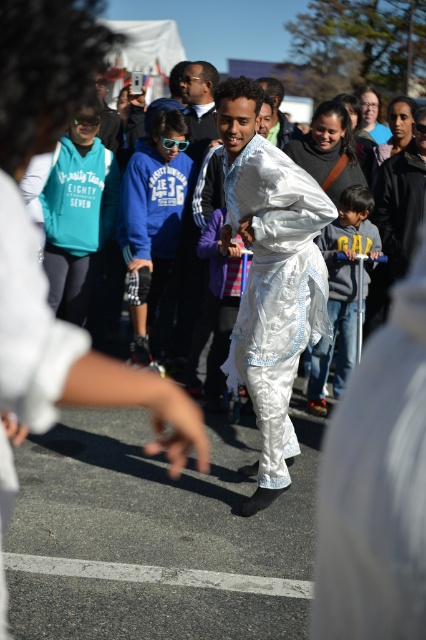
Question: Where is shiny silver robe at center located in relation to dark gray sweater at center in the image?

Choices:
 (A) right
 (B) left

Answer: (B)

Question: Which is farther from the shiny silver robe at center?

Choices:
 (A) blue fleece hoodie at center
 (B) dark gray sweater at center

Answer: (A)

Question: Which of the following is the farthest from the observer?

Choices:
 (A) blue fleece hoodie at center
 (B) shiny silver robe at center
 (C) dark gray sweater at center

Answer: (A)

Question: Does shiny silver robe at center appear on the right side of dark gray sweater at center?

Choices:
 (A) yes
 (B) no

Answer: (B)

Question: Is shiny silver robe at center bigger than blue fleece hoodie at center?

Choices:
 (A) yes
 (B) no

Answer: (A)

Question: Considering the real-world distances, which object is closest to the shiny silver robe at center?

Choices:
 (A) dark gray sweater at center
 (B) blue fleece hoodie at center

Answer: (A)